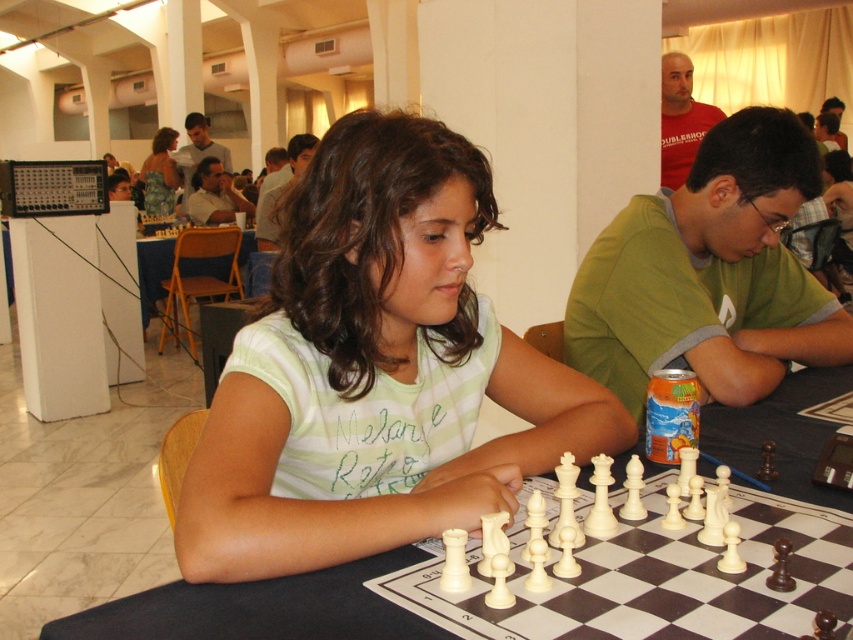
You are a photographer trying to capture a closeup of the chessboard without blocking the view of the girl. You notice the green fabric shirt at center and the smooth brown shirt at center. Which shirt should you avoid moving closer to the camera to prevent blocking the chessboard?

The green fabric shirt at center might be wider than smooth brown shirt at center, so you should avoid moving the green fabric shirt at center closer to the camera as it could block the chessboard more easily.